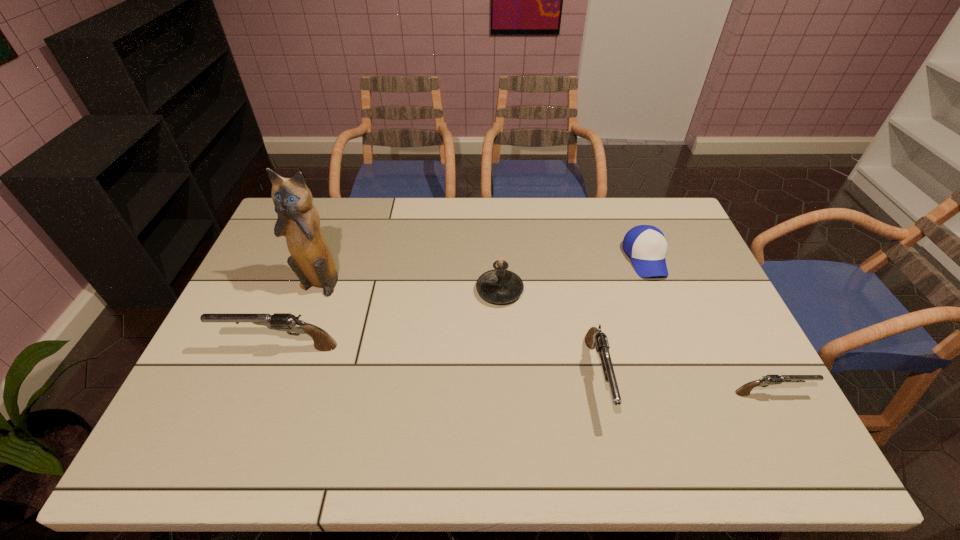
This screenshot has height=540, width=960. Identify the location of blank area in the image that satisfies the following two spatial constraints: 1. on the face of the cat; 2. aiming along the barrel of the leftmost gun. (295, 347).

Locate an element on the screen. Image resolution: width=960 pixels, height=540 pixels. blank space that satisfies the following two spatial constraints: 1. on the front-facing side of the second shortest object; 2. aiming along the barrel of the leftmost gun is located at coordinates (680, 347).

Where is `vacant area in the image that satisfies the following two spatial constraints: 1. on the face of the cat; 2. aiming along the barrel of the leftmost gun`? Image resolution: width=960 pixels, height=540 pixels. vacant area in the image that satisfies the following two spatial constraints: 1. on the face of the cat; 2. aiming along the barrel of the leftmost gun is located at coordinates (295, 347).

The height and width of the screenshot is (540, 960). I want to click on free space that satisfies the following two spatial constraints: 1. on the face of the tallest object; 2. on the left side of the candle, so click(316, 290).